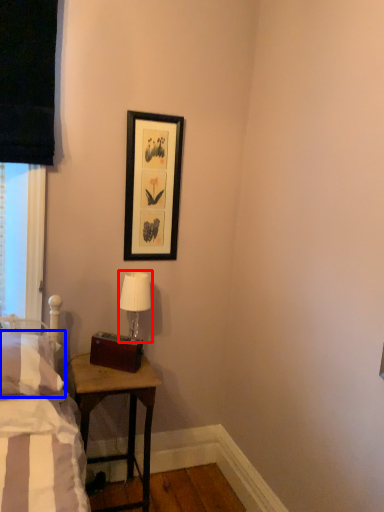
Question: Which of the following is the closest to the observer, table lamp (highlighted by a red box) or pillow (highlighted by a blue box)?

Choices:
 (A) table lamp
 (B) pillow

Answer: (B)